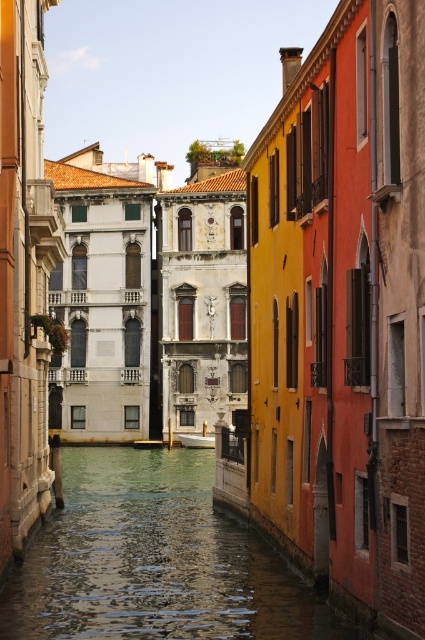
You are a tourist standing on the left bank of the canal and want to take a photo of the white glossy boat at center. Which direction should you look to capture both the greenish water at center and the boat in your shot?

You should look towards the center of the canal because the greenish water at center is located below the white glossy boat at center, meaning both are positioned in the central area of the canal.

You are standing at the point closest to the viewer in the image. Which point, point (189, 548) or point (189, 433), are you standing at?

You are standing at point (189, 548) because it is in front of point (189, 433), so it is closer to the viewer.

You are standing on the left bank of the canal and see the greenish water at center and the white glossy boat at center. Which object is closer to your position?

The greenish water at center is closer to your position because it is located to the left of the white glossy boat at center, which is further away.